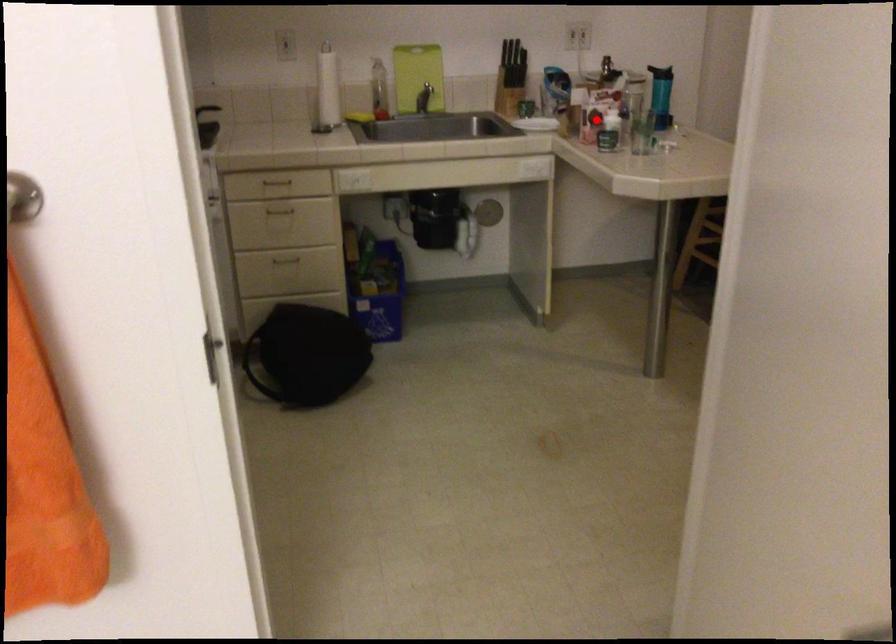
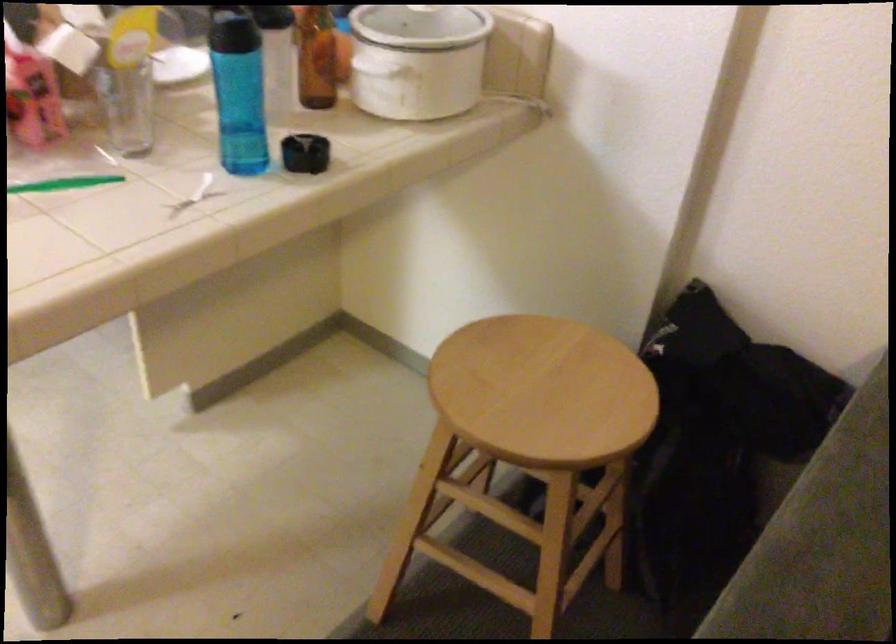
Question: I am providing you with two images of the same scene from different viewpoints. Image1 has a red point marked. In image2, the corresponding 3D location appears at what relative position? Reply with the corresponding letter.

Choices:
 (A) Closer
 (B) Farther

Answer: (A)